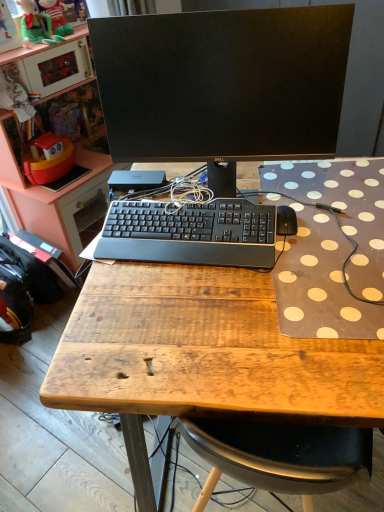
Identify the location of unoccupied area behind black matte mouse at right. (282, 185).